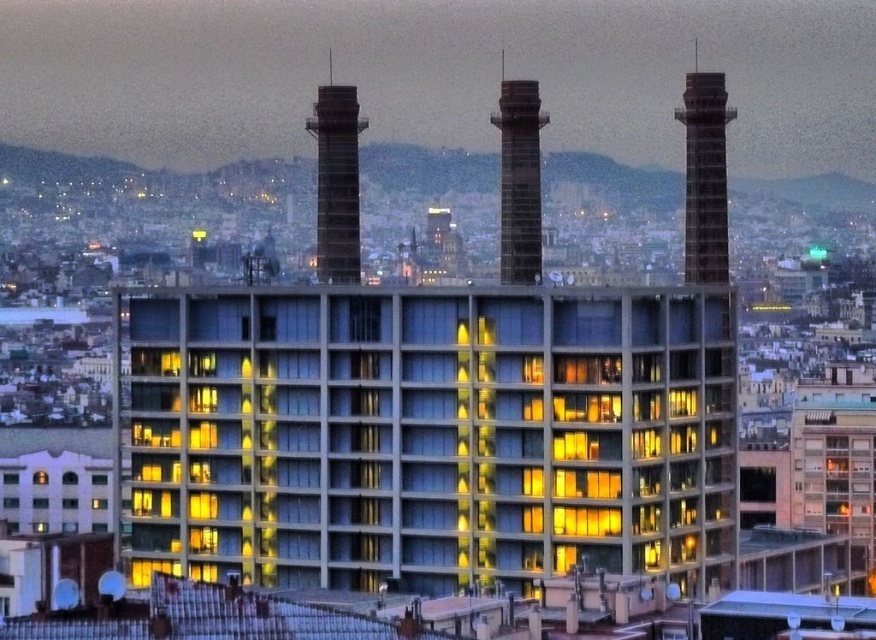
You are a city planner assessing the height of structures in this area. Given the scene, which of the two objects, the concrete building at center or the smooth concrete chimney at center, is taller?

The smooth concrete chimney at center is taller than the concrete building at center, as stated in the description.

You are an urban planner reviewing this area. You need to determine the spatial arrangement between the rustic brick chimney at upper right and the concrete chimney at center. Which one is located to the right of the other?

The rustic brick chimney at upper right is positioned on the right side of the concrete chimney at center.

You are a city planner reviewing this area. You need to determine the order of the structures from the closest to farthest from your viewpoint. Which structure is closer to you between the concrete building at center and the smooth concrete chimney at center?

The concrete building at center is closer to you because it is positioned under the smooth concrete chimney at center, indicating it is in front.